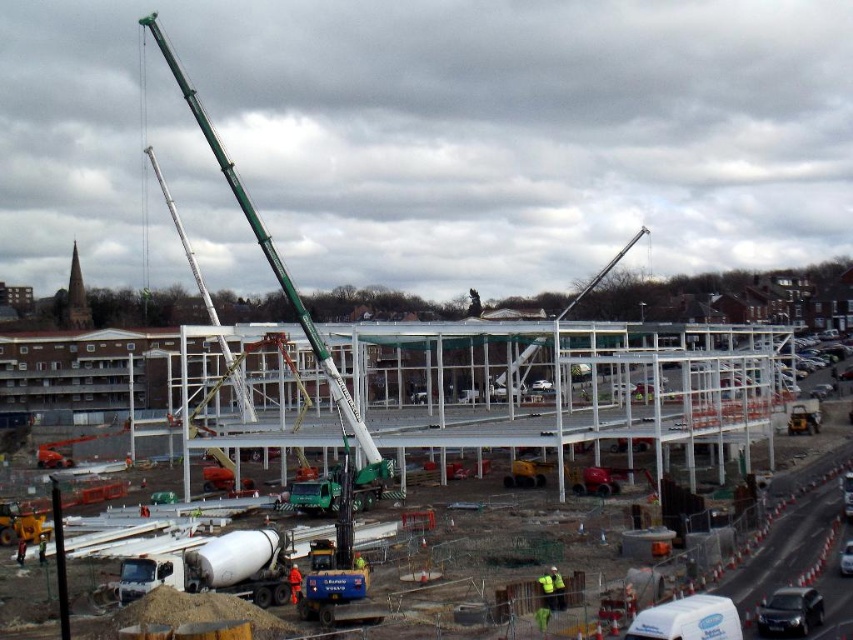
Can you confirm if white metallic framework at center is bigger than white glossy van at lower right?

Correct, white metallic framework at center is larger in size than white glossy van at lower right.

The image size is (853, 640). I want to click on white metallic framework at center, so click(572, 392).

Between point (363, 339) and point (729, 632), which one is positioned behind?

Point (363, 339)

Find the location of a particular element. The height and width of the screenshot is (640, 853). white metallic framework at center is located at coordinates (572, 392).

Is green metallic crane at center thinner than metallic silver crane at center?

No, green metallic crane at center is not thinner than metallic silver crane at center.

Between green metallic crane at center and metallic silver crane at center, which one appears on the right side from the viewer's perspective?

metallic silver crane at center is more to the right.

Where is `green metallic crane at center`? This screenshot has height=640, width=853. green metallic crane at center is located at coordinates (277, 272).

Where is `green metallic crane at center`? Image resolution: width=853 pixels, height=640 pixels. green metallic crane at center is located at coordinates (277, 272).

Which is more to the left, white metallic framework at center or metallic silver crane at center?

white metallic framework at center

At what (x,y) coordinates should I click in order to perform the action: click on white metallic framework at center. Please return your answer as a coordinate pair (x, y). The width and height of the screenshot is (853, 640). Looking at the image, I should click on (572, 392).